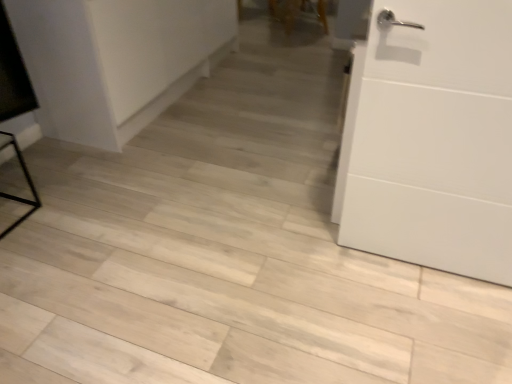
Question: From a real-world perspective, is white matte cabinet at upper left physically located above or below white matte door at right?

Choices:
 (A) below
 (B) above

Answer: (A)

Question: Considering the positions of white matte cabinet at upper left and white matte door at right in the image, is white matte cabinet at upper left bigger or smaller than white matte door at right?

Choices:
 (A) big
 (B) small

Answer: (A)

Question: Which of these objects is positioned closest to the white matte door at right?

Choices:
 (A) wooden chair at upper center
 (B) white matte cabinet at upper left

Answer: (B)

Question: Which of these objects is positioned closest to the white matte cabinet at upper left?

Choices:
 (A) wooden chair at upper center
 (B) white matte door at right

Answer: (B)